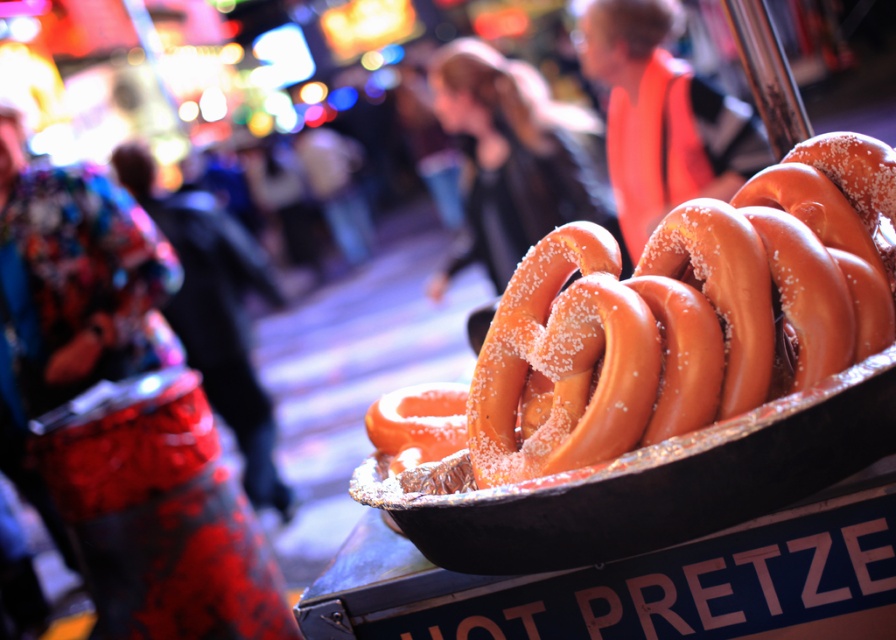
Between sugared golden pretzel at right and sugared pretzel at right, which one appears on the left side from the viewer's perspective?

sugared golden pretzel at right

Consider the image. Does sugared golden pretzel at right have a larger size compared to sugared pretzel at right?

Actually, sugared golden pretzel at right might be smaller than sugared pretzel at right.

Measure the distance between point [653,406] and camera.

35.97 inches

The image size is (896, 640). I want to click on sugared golden pretzel at right, so click(x=691, y=310).